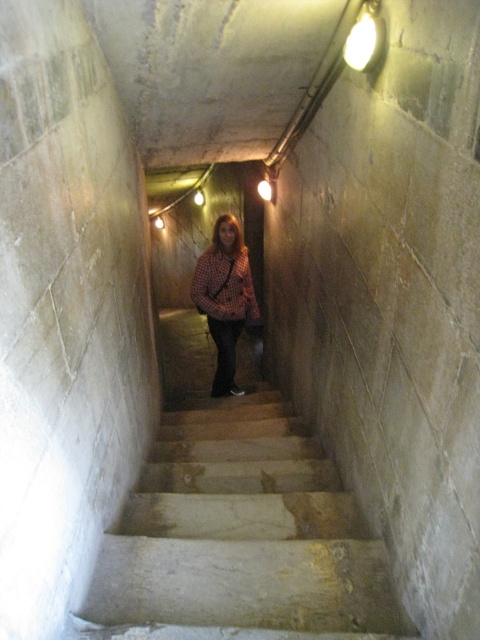
Question: Does concrete stairs at center have a larger size compared to checkered fabric shirt at center?

Choices:
 (A) yes
 (B) no

Answer: (B)

Question: Which point appears closest to the camera in this image?

Choices:
 (A) (196, 305)
 (B) (340, 573)

Answer: (B)

Question: Is the position of concrete stairs at center more distant than that of checkered fabric shirt at center?

Choices:
 (A) no
 (B) yes

Answer: (A)

Question: Among these points, which one is farthest from the camera?

Choices:
 (A) click(x=227, y=244)
 (B) click(x=208, y=467)

Answer: (A)

Question: Does concrete stairs at center have a larger size compared to checkered fabric shirt at center?

Choices:
 (A) no
 (B) yes

Answer: (A)